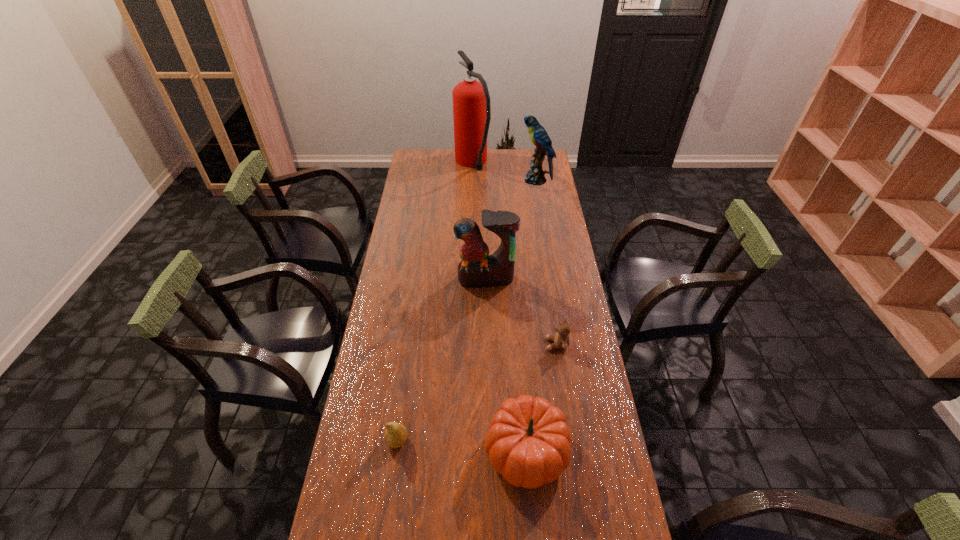
Image resolution: width=960 pixels, height=540 pixels. I want to click on teddy bear at the right edge, so click(561, 339).

Locate an element on the screen. This screenshot has width=960, height=540. free location at the far edge of the desktop is located at coordinates (499, 168).

The image size is (960, 540). What are the coordinates of `vacant point at the left edge` in the screenshot? It's located at (407, 316).

Where is `vacant area at the right edge of the desktop`? Image resolution: width=960 pixels, height=540 pixels. vacant area at the right edge of the desktop is located at coordinates (531, 212).

Where is `vacant space at the far right corner`? The width and height of the screenshot is (960, 540). vacant space at the far right corner is located at coordinates (543, 163).

Where is `empty space that is in between the third shortest object and the third farthest object`? The width and height of the screenshot is (960, 540). empty space that is in between the third shortest object and the third farthest object is located at coordinates (506, 365).

Identify the location of vacant space that is in between the farther parrot and the pear. The height and width of the screenshot is (540, 960). (467, 310).

I want to click on vacant point located between the leftmost object and the left parrot, so click(x=442, y=360).

Where is `free space between the fourth tallest object and the fire extinguisher`? Image resolution: width=960 pixels, height=540 pixels. free space between the fourth tallest object and the fire extinguisher is located at coordinates point(499,307).

Where is `free space between the teddy bear and the third shortest object`? free space between the teddy bear and the third shortest object is located at coordinates (541, 397).